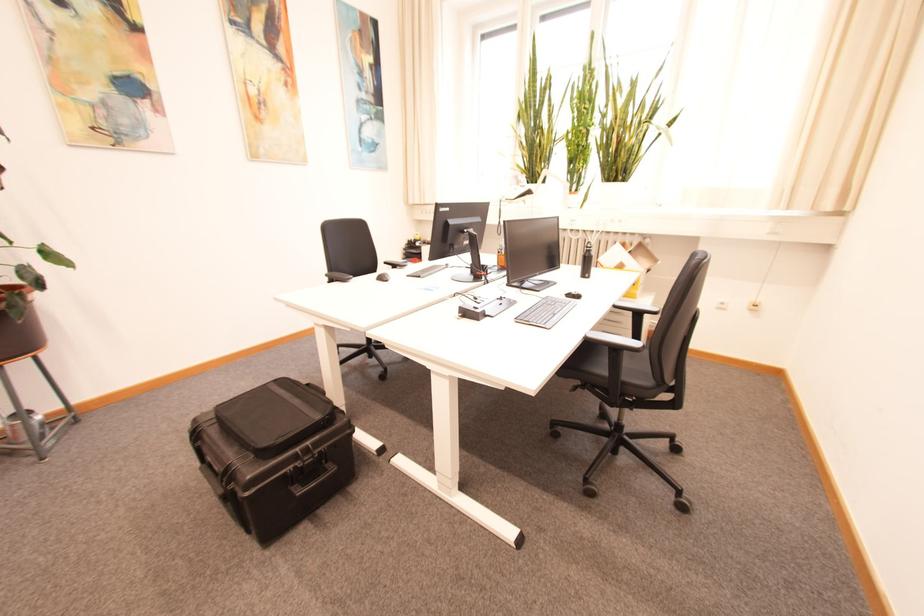
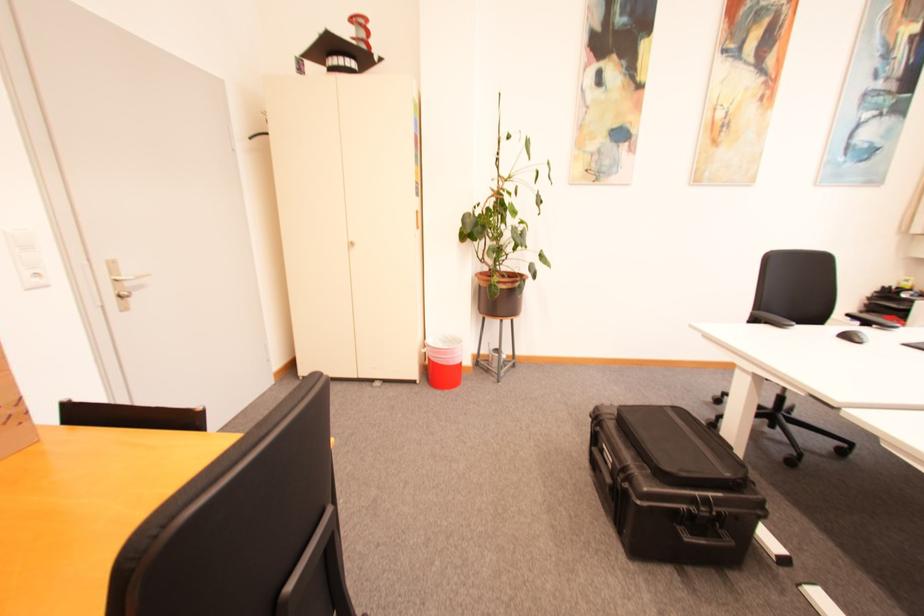
Question: The camera is either moving clockwise (left) or counter-clockwise (right) around the object. The first image is from the beginning of the video and the second image is from the end. Is the camera moving left or right when shooting the video?

Choices:
 (A) Left
 (B) Right

Answer: (B)